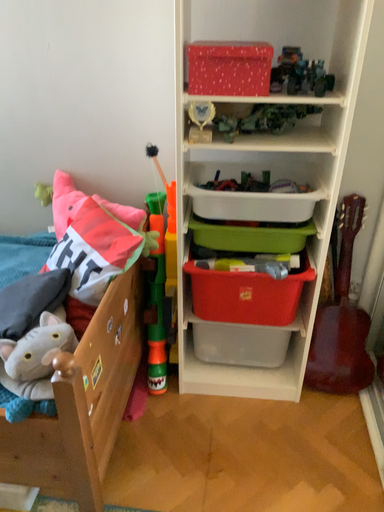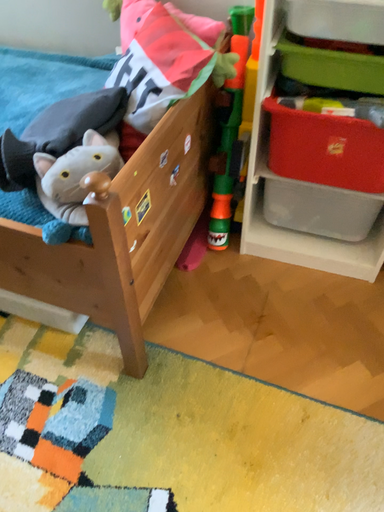
Question: Which way did the camera rotate in the video?

Choices:
 (A) rotated upward
 (B) rotated downward

Answer: (B)